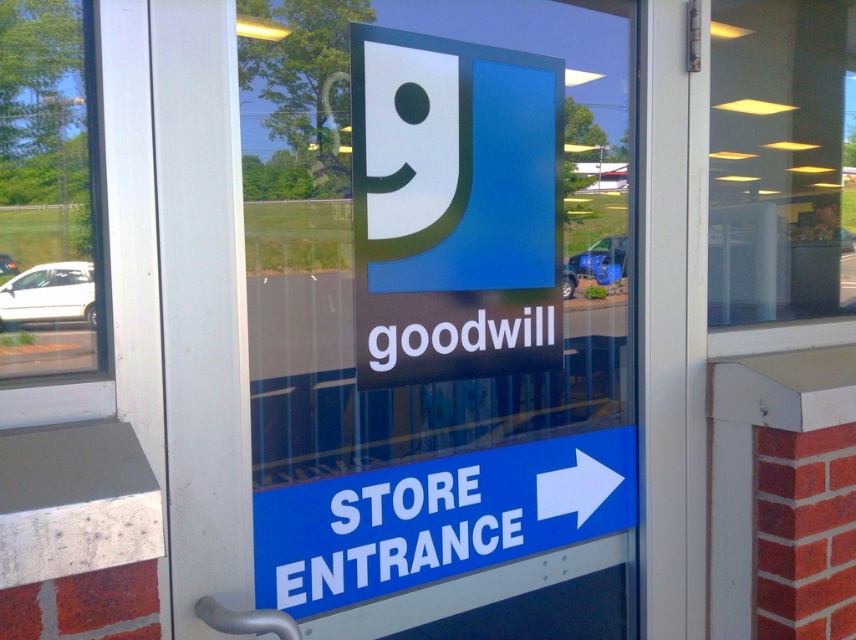
What is located at the coordinates point (453, 208) in the image?

The point (453, 208) is occupied by the matte plastic sign at center.

You are standing in front of a glass door and see a matte plastic sign at center and a transparent glass window at center. Which object is shorter in height?

The matte plastic sign at center is not as tall as the transparent glass window at center, so the matte plastic sign at center is shorter in height.

You are standing in front of the glass door and want to enter the store. Which object, the transparent glass door at center or the transparent glass window at center, should you use to enter?

You should use the transparent glass door at center to enter because it is bigger than the transparent glass window at center, making it more suitable for passage.